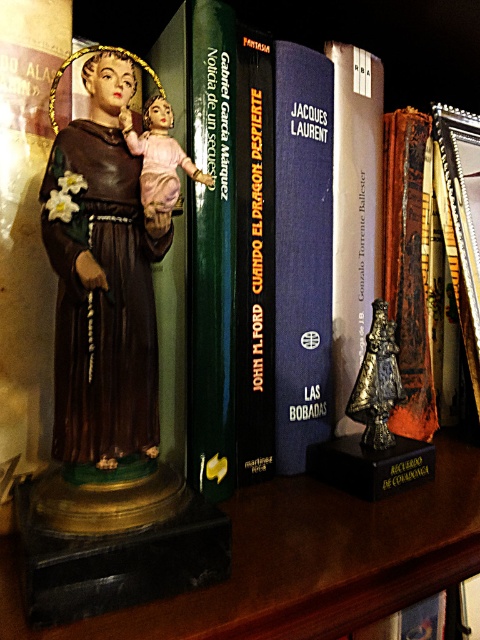
Question: Among these points, which one is farthest from the camera?

Choices:
 (A) (369, 417)
 (B) (277, 221)
 (C) (252, 140)
 (D) (157, 145)

Answer: (A)

Question: Is silver metallic bell at center positioned before shiny bronze bell at center?

Choices:
 (A) yes
 (B) no

Answer: (B)

Question: Considering the real-world distances, which object is closest to the porcelain doll at center?

Choices:
 (A) green matte book at center
 (B) shiny bronze bell at center

Answer: (A)

Question: Which is farther from the green matte book at center?

Choices:
 (A) blue hardcover book at center
 (B) shiny bronze bell at center

Answer: (B)

Question: In this image, where is hardcover book at center located relative to shiny bronze bell at center?

Choices:
 (A) right
 (B) left

Answer: (B)

Question: Is green matte book at center positioned at the back of hardcover book at center?

Choices:
 (A) yes
 (B) no

Answer: (B)